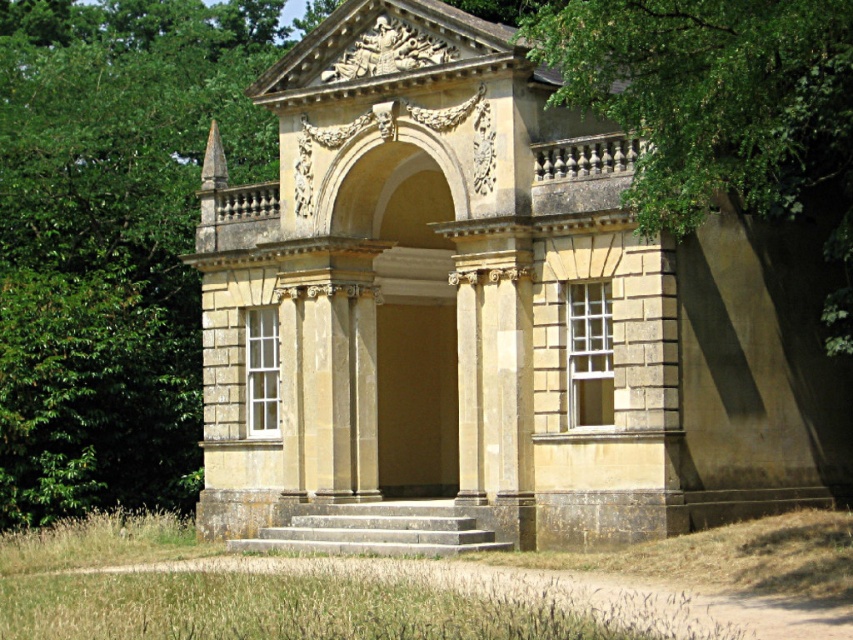
Question: Which point is closer to the camera?

Choices:
 (A) (647, 166)
 (B) (422, 524)
 (C) (22, 113)

Answer: (A)

Question: Considering the relative positions of green leafy tree at upper right and smooth stone stairs at center in the image provided, where is green leafy tree at upper right located with respect to smooth stone stairs at center?

Choices:
 (A) below
 (B) above

Answer: (B)

Question: Is the position of beige stone building at center less distant than that of green leafy tree at left?

Choices:
 (A) yes
 (B) no

Answer: (A)

Question: Is green leafy tree at left bigger than green leafy tree at upper right?

Choices:
 (A) no
 (B) yes

Answer: (B)

Question: Which of the following is the closest to the observer?

Choices:
 (A) (555, 436)
 (B) (149, 276)

Answer: (A)

Question: Considering the real-world distances, which object is farthest from the beige stone building at center?

Choices:
 (A) green leafy tree at upper right
 (B) green leafy tree at left

Answer: (B)